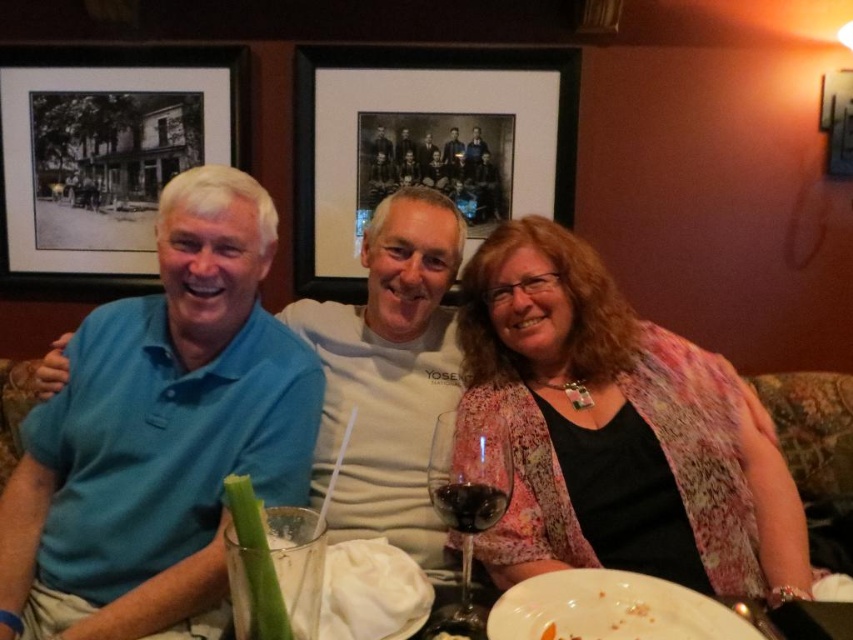
Between point (90, 157) and point (463, 506), which one is positioned behind?

The point (90, 157) is more distant.

Between black matte picture frame at upper left and transparent glass wine glass at center, which one is positioned lower?

transparent glass wine glass at center is lower down.

Is point (200, 52) in front of point (457, 609)?

No, it is not.

Image resolution: width=853 pixels, height=640 pixels. Find the location of `black matte picture frame at upper left`. black matte picture frame at upper left is located at coordinates (109, 148).

Measure the distance between point (572, 83) and camera.

Point (572, 83) and camera are 7.23 feet apart.

Between point (303, 116) and point (447, 500), which one is positioned in front?

Point (447, 500) is more forward.

Locate an element on the screen. black matte picture frame at upper center is located at coordinates (425, 144).

Is floral-patterned blouse at center smaller than dark glass at center?

No.

Can you confirm if floral-patterned blouse at center is positioned below dark glass at center?

No.

Between point (680, 365) and point (474, 516), which one is positioned in front?

Point (474, 516) is more forward.

The height and width of the screenshot is (640, 853). Identify the location of floral-patterned blouse at center. pos(618,432).